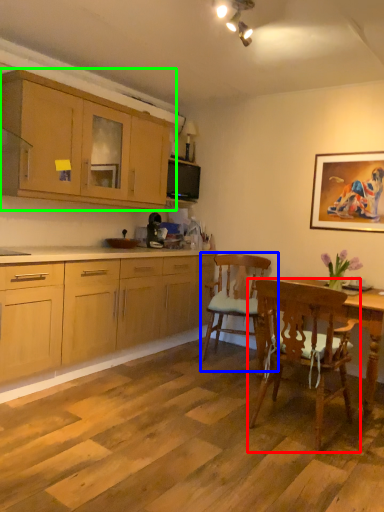
Question: Considering the real-world distances, which object is farthest from chair (highlighted by a red box)? chair (highlighted by a blue box) or cabinetry (highlighted by a green box)?

Choices:
 (A) chair
 (B) cabinetry

Answer: (B)